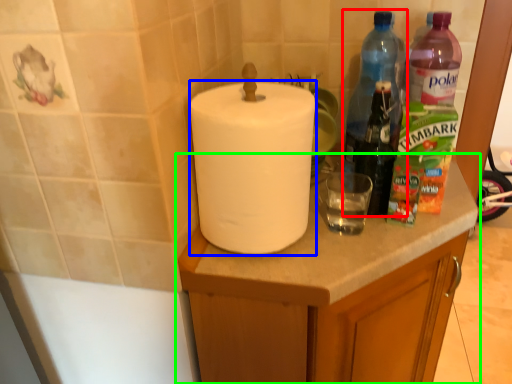
Question: Based on their relative distances, which object is nearer to bottle (highlighted by a red box)? Choose from paper towel (highlighted by a blue box) and cabinetry (highlighted by a green box).

Choices:
 (A) paper towel
 (B) cabinetry

Answer: (B)